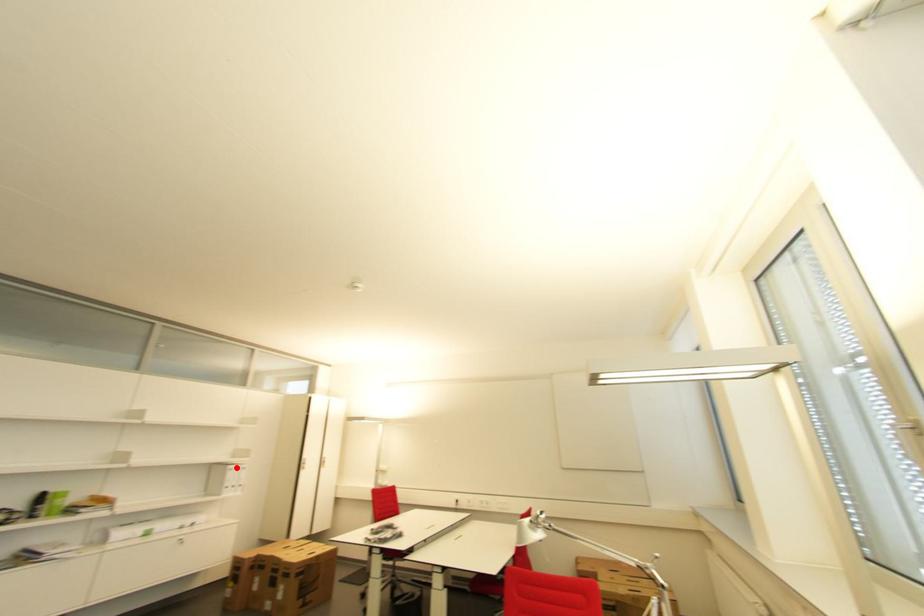
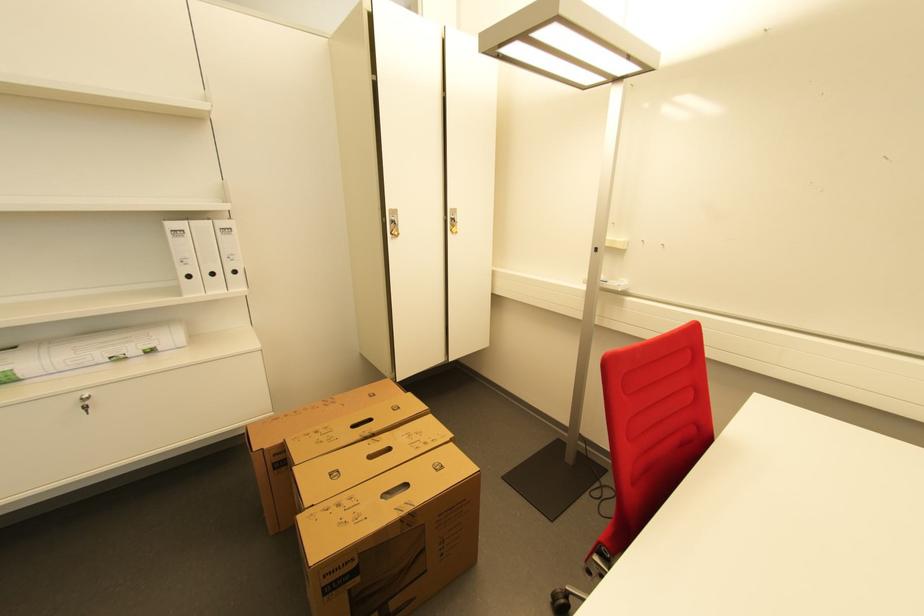
Find the pixel in the second image that matches the highlighted location in the first image.

(176, 225)